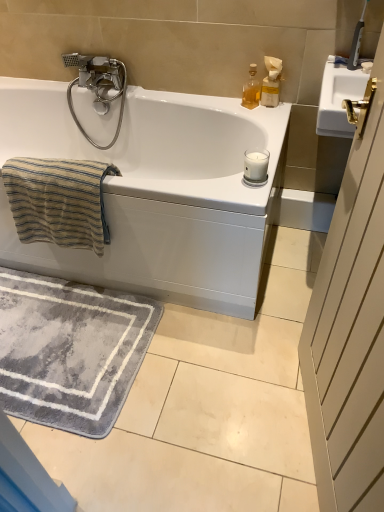
Question: Considering the relative sizes of white plastic soap dispenser at upper right, the 1th soap dispenser positioned from the right, and white glossy bathtub at upper center in the image provided, is white plastic soap dispenser at upper right, the 1th soap dispenser positioned from the right, taller than white glossy bathtub at upper center?

Choices:
 (A) no
 (B) yes

Answer: (A)

Question: Can you confirm if white plastic soap dispenser at upper right, the 1th soap dispenser positioned from the right, is bigger than white glossy bathtub at upper center?

Choices:
 (A) no
 (B) yes

Answer: (A)

Question: Is white plastic soap dispenser at upper right, the second soap dispenser when ordered from left to right, smaller than white glossy bathtub at upper center?

Choices:
 (A) no
 (B) yes

Answer: (B)

Question: Can you confirm if white plastic soap dispenser at upper right, the second soap dispenser when ordered from left to right, is thinner than white glossy bathtub at upper center?

Choices:
 (A) no
 (B) yes

Answer: (B)

Question: Is the depth of white plastic soap dispenser at upper right, the 1th soap dispenser positioned from the right, less than that of white glossy bathtub at upper center?

Choices:
 (A) yes
 (B) no

Answer: (B)

Question: Is white plastic soap dispenser at upper right, the 1th soap dispenser positioned from the right, placed right next to white glossy bathtub at upper center?

Choices:
 (A) no
 (B) yes

Answer: (A)

Question: Is white wood screen door at right placed right next to translucent glass bottle at upper right, arranged as the 1th soap dispenser when viewed from the left?

Choices:
 (A) no
 (B) yes

Answer: (A)

Question: Is the position of white wood screen door at right more distant than that of translucent glass bottle at upper right, arranged as the 1th soap dispenser when viewed from the left?

Choices:
 (A) yes
 (B) no

Answer: (B)

Question: From a real-world perspective, is white wood screen door at right beneath translucent glass bottle at upper right, arranged as the 1th soap dispenser when viewed from the left?

Choices:
 (A) yes
 (B) no

Answer: (A)

Question: Is white wood screen door at right oriented towards translucent glass bottle at upper right, which appears as the 2th soap dispenser when viewed from the right?

Choices:
 (A) yes
 (B) no

Answer: (B)

Question: Can you confirm if white wood screen door at right is thinner than translucent glass bottle at upper right, which appears as the 2th soap dispenser when viewed from the right?

Choices:
 (A) yes
 (B) no

Answer: (B)

Question: Is white wood screen door at right outside of translucent glass bottle at upper right, arranged as the 1th soap dispenser when viewed from the left?

Choices:
 (A) no
 (B) yes

Answer: (B)

Question: Is white wood screen door at right completely or partially outside of silver metallic faucet at upper left?

Choices:
 (A) yes
 (B) no

Answer: (A)